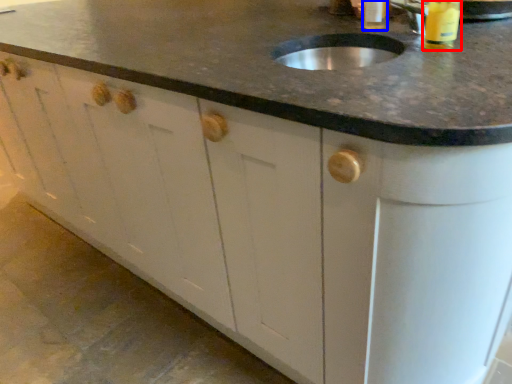
Question: Which of the following is the farthest to the observer, beverage (highlighted by a red box) or beverage (highlighted by a blue box)?

Choices:
 (A) beverage
 (B) beverage

Answer: (B)